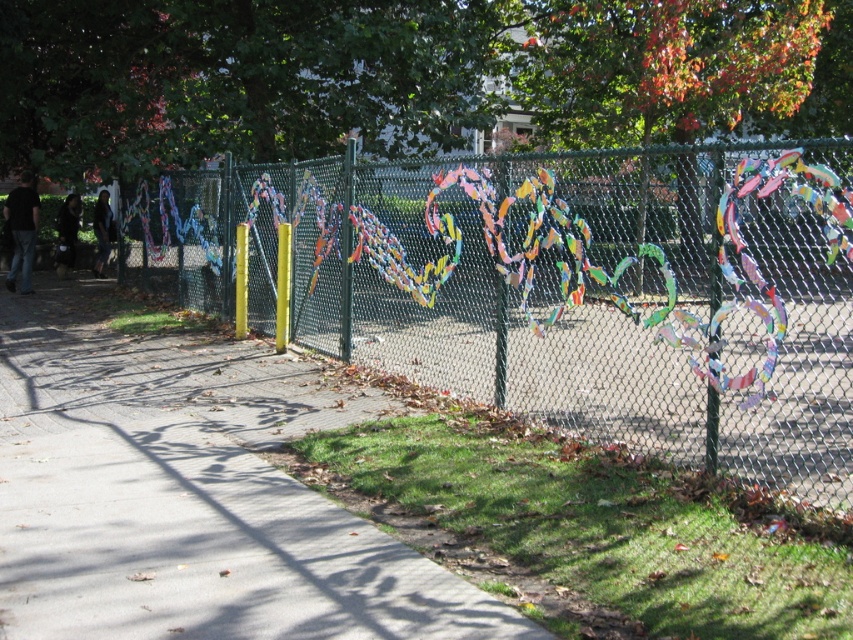
Question: Which point appears farthest from the camera in this image?

Choices:
 (A) (734, 212)
 (B) (9, 545)

Answer: (A)

Question: Is green chain-link fence at center thinner than gray concrete pavement at lower left?

Choices:
 (A) no
 (B) yes

Answer: (A)

Question: Is green chain-link fence at center wider than gray concrete pavement at lower left?

Choices:
 (A) no
 (B) yes

Answer: (B)

Question: Which object appears closest to the camera in this image?

Choices:
 (A) gray concrete pavement at lower left
 (B) green chain-link fence at center

Answer: (A)

Question: Considering the relative positions of green chain-link fence at center and gray concrete pavement at lower left in the image provided, where is green chain-link fence at center located with respect to gray concrete pavement at lower left?

Choices:
 (A) below
 (B) above

Answer: (B)